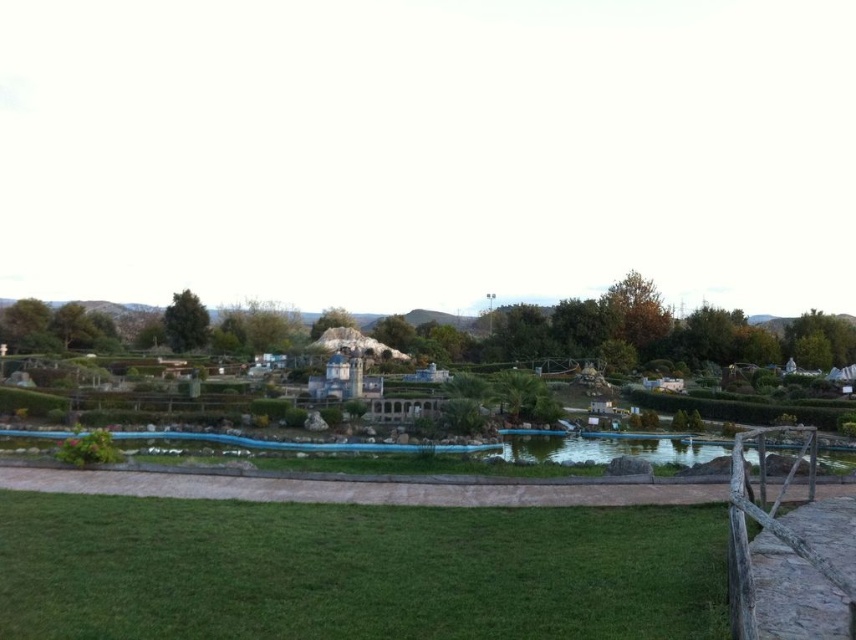
Question: Can you confirm if smooth concrete miniature park at center is positioned to the right of green glass pond at center?

Choices:
 (A) yes
 (B) no

Answer: (B)

Question: Does green grass at lower center appear on the left side of transparent blue pond at center?

Choices:
 (A) yes
 (B) no

Answer: (A)

Question: Which object is the closest to the green glass pond at center?

Choices:
 (A) smooth concrete miniature park at center
 (B) transparent blue pond at center
 (C) green grass at lower center

Answer: (B)

Question: Which of the following is the closest to the observer?

Choices:
 (A) smooth concrete miniature park at center
 (B) green grass at lower center
 (C) green glass pond at center
 (D) transparent blue pond at center

Answer: (B)

Question: Among these points, which one is nearest to the camera?

Choices:
 (A) (789, 353)
 (B) (676, 512)
 (C) (831, 445)

Answer: (B)

Question: From the image, what is the correct spatial relationship of smooth concrete miniature park at center in relation to transparent blue pond at center?

Choices:
 (A) below
 (B) above

Answer: (B)